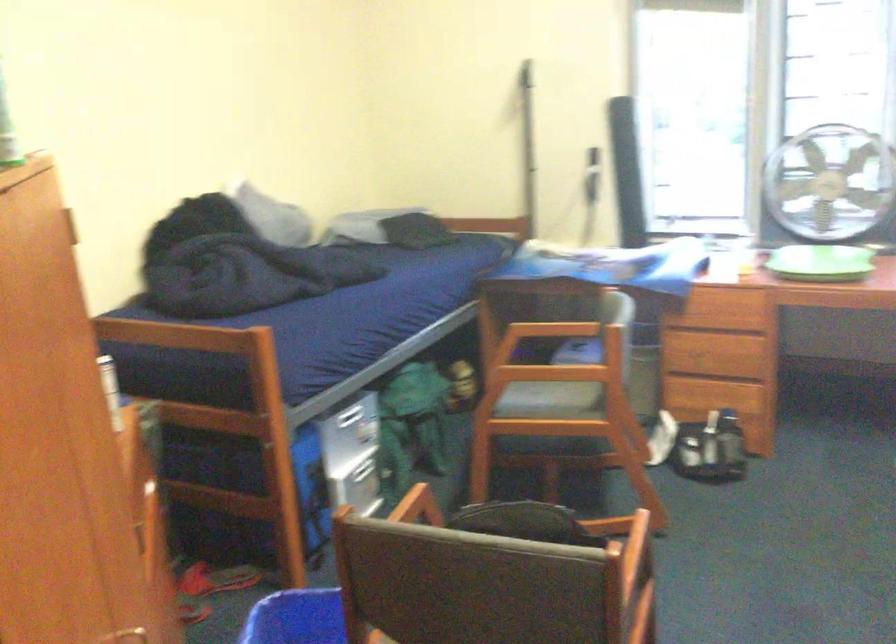
Describe the element at coordinates (141, 630) in the screenshot. I see `the silver drawer handle` at that location.